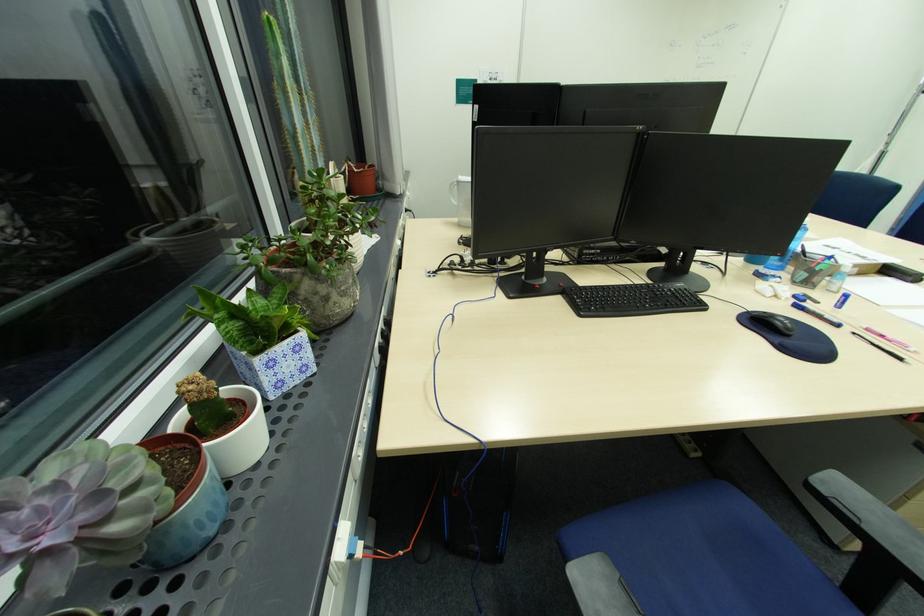
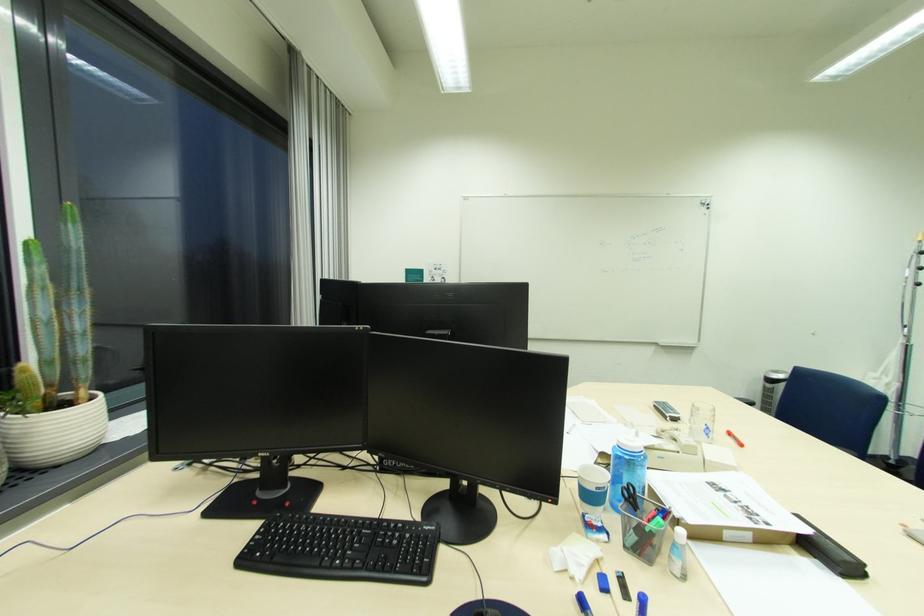
The point at [843,249] is marked in the first image. Where is the corresponding point in the second image?

(731, 491)